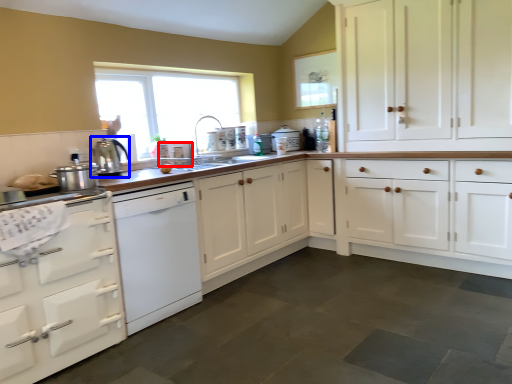
Question: Which of the following is the closest to the observer, appliance (highlighted by a red box) or kitchen appliance (highlighted by a blue box)?

Choices:
 (A) appliance
 (B) kitchen appliance

Answer: (B)